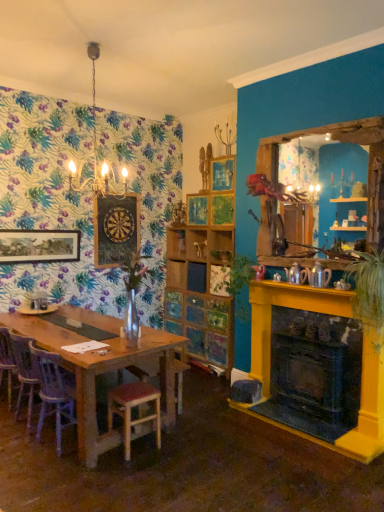
Question: Should I look upward or downward to see wooden dartboard at upper left, the first picture frame from the back?

Choices:
 (A) down
 (B) up

Answer: (B)

Question: From the image's perspective, is wooden dartboard at upper left, acting as the 2th picture frame starting from the left, located beneath green leafy plant at center, marked as the first plant in a left-to-right arrangement?

Choices:
 (A) no
 (B) yes

Answer: (A)

Question: Is wooden dartboard at upper left, the first picture frame from the back, aimed at green leafy plant at center, marked as the 1th plant in a back-to-front arrangement?

Choices:
 (A) no
 (B) yes

Answer: (B)

Question: Are wooden dartboard at upper left, acting as the 2th picture frame starting from the left, and green leafy plant at center, marked as the 1th plant in a back-to-front arrangement, far apart?

Choices:
 (A) yes
 (B) no

Answer: (A)

Question: Can you confirm if wooden dartboard at upper left, the first picture frame from the back, is bigger than green leafy plant at center, marked as the first plant in a left-to-right arrangement?

Choices:
 (A) yes
 (B) no

Answer: (B)

Question: From the image's perspective, is wooden dartboard at upper left, the 1th picture frame in the right-to-left sequence, on green leafy plant at center, marked as the first plant in a left-to-right arrangement?

Choices:
 (A) no
 (B) yes

Answer: (B)

Question: Does wooden dartboard at upper left, acting as the 2th picture frame starting from the left, appear on the left side of green leafy plant at center, the second plant positioned from the front?

Choices:
 (A) yes
 (B) no

Answer: (A)

Question: Could you tell me if white porcelain plate at left is turned towards green leafy plant at right, which ranks as the first plant in right-to-left order?

Choices:
 (A) yes
 (B) no

Answer: (B)

Question: From a real-world perspective, is white porcelain plate at left beneath green leafy plant at right, arranged as the 1th plant when viewed from the front?

Choices:
 (A) no
 (B) yes

Answer: (B)

Question: Considering the relative sizes of white porcelain plate at left and green leafy plant at right, arranged as the 1th plant when viewed from the front, in the image provided, is white porcelain plate at left thinner than green leafy plant at right, arranged as the 1th plant when viewed from the front,?

Choices:
 (A) yes
 (B) no

Answer: (A)

Question: Is green leafy plant at right, which ranks as the first plant in right-to-left order, inside white porcelain plate at left?

Choices:
 (A) no
 (B) yes

Answer: (A)

Question: Considering the relative sizes of white porcelain plate at left and green leafy plant at right, which is counted as the second plant, starting from the back, in the image provided, is white porcelain plate at left smaller than green leafy plant at right, which is counted as the second plant, starting from the back,?

Choices:
 (A) yes
 (B) no

Answer: (A)

Question: Can you confirm if white porcelain plate at left is wider than green leafy plant at right, which is counted as the second plant, starting from the back?

Choices:
 (A) no
 (B) yes

Answer: (A)

Question: Is wooden at left, placed as the 1th chair when sorted from front to back, oriented towards metallic yellow fireplace at right?

Choices:
 (A) no
 (B) yes

Answer: (A)